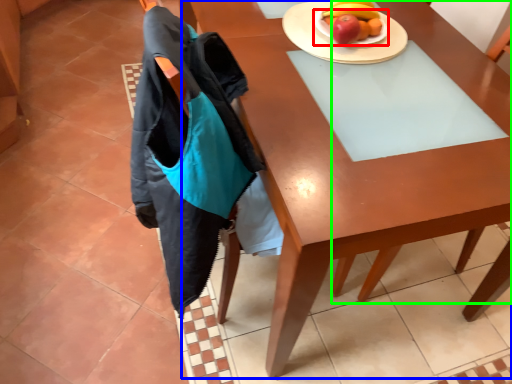
Question: Which is nearer to the plate (highlighted by a red box)? desk (highlighted by a blue box) or chair (highlighted by a green box).

Choices:
 (A) desk
 (B) chair

Answer: (B)